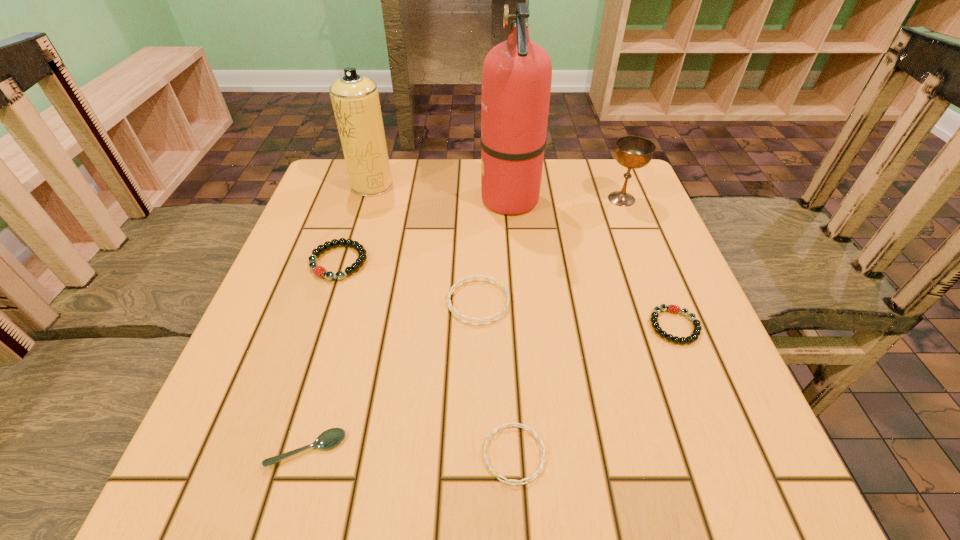
The image size is (960, 540). What are the coordinates of `the nearer blue bracelet` in the screenshot? It's located at (523, 426).

Identify the location of the smaller blue bracelet. (523, 426).

Locate an element on the screen. Image resolution: width=960 pixels, height=540 pixels. free location located on the side of the red fire extinguisher with the nozzle and handle is located at coordinates (403, 199).

Find the location of a particular element. The image size is (960, 540). free location located on the side of the red fire extinguisher with the nozzle and handle is located at coordinates (343, 199).

Identify the location of vacant space situated on the side of the red fire extinguisher with the nozzle and handle. (388, 199).

Where is `free space located on the right of the second tallest object`? free space located on the right of the second tallest object is located at coordinates (451, 185).

Identify the location of free point located on the left of the chalice. The image size is (960, 540). (507, 199).

Identify the location of free region located on the back of the bigger black bracelet. The height and width of the screenshot is (540, 960). (362, 191).

Identify the location of vacant area located on the surface of the bigger blue bracelet showing star-shaped elements. (535, 302).

Locate an element on the screen. The image size is (960, 540). free space located 0.170m on the back of the nearer black bracelet is located at coordinates (643, 248).